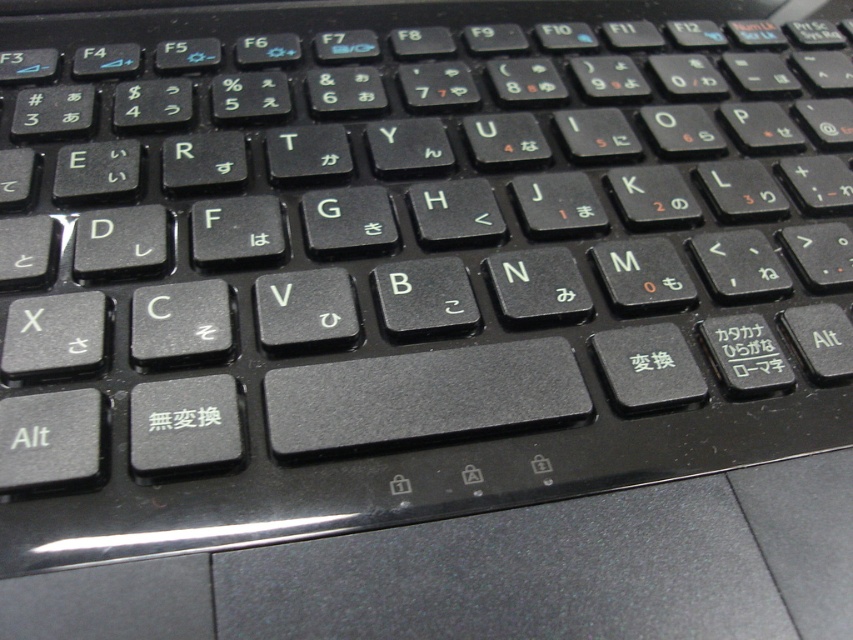
You are using a laptop and notice that the black matte keyboard at center and the black matte text at center are both visible. Which object is closer to your eyes?

The black matte keyboard at center is closer to your eyes because it is in front of the black matte text at center.

You are trying to type a message on the laptop keyboard shown. The black matte keyboard at center has some text underneath it. Can you see the black matte text at center while typing?

The black matte keyboard at center is positioned over the black matte text at center, so the text is hidden underneath and cannot be seen while typing.

You are positioning a laptop on a desk and need to align it so that the black matte keyboard at center is directly in front of you. According to the image, what are the coordinates where you should place the keyboard?

The black matte keyboard at center should be placed at coordinates point (418, 237) as specified in the description.